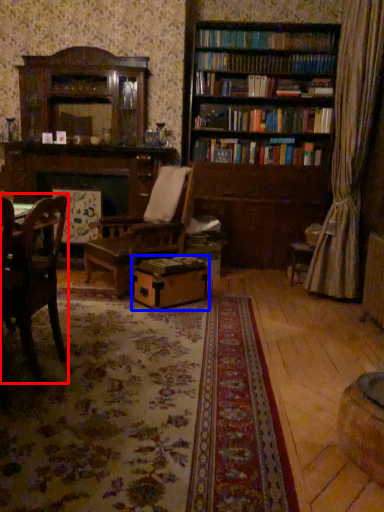
Question: Which of the following is the farthest to the observer, chair (highlighted by a red box) or cardboard box (highlighted by a blue box)?

Choices:
 (A) chair
 (B) cardboard box

Answer: (B)